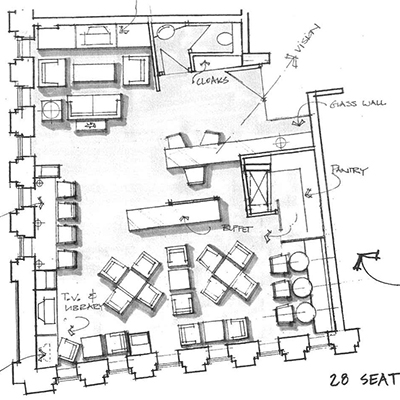
Find the location of `lines indicating door opening`. lines indicating door opening is located at coordinates (260, 82), (173, 68).